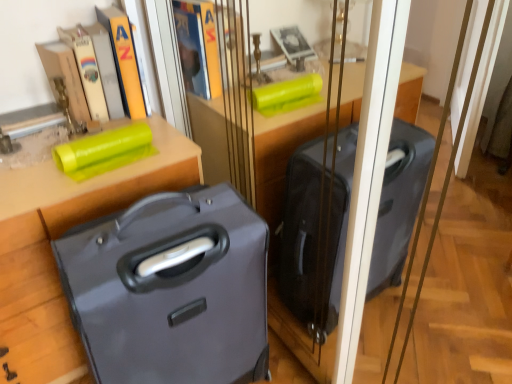
Question: Considering the positions of matte black suitcase at left and matte gray suitcase at lower left in the image, is matte black suitcase at left taller or shorter than matte gray suitcase at lower left?

Choices:
 (A) tall
 (B) short

Answer: (B)

Question: Visually, is matte black suitcase at left positioned to the left or to the right of matte gray suitcase at lower left?

Choices:
 (A) left
 (B) right

Answer: (A)

Question: In terms of size, does matte black suitcase at left appear bigger or smaller than matte gray suitcase at lower left?

Choices:
 (A) big
 (B) small

Answer: (A)

Question: Is matte gray suitcase at lower left in front of or behind matte black suitcase at left in the image?

Choices:
 (A) front
 (B) behind

Answer: (A)

Question: Is matte gray suitcase at lower left wider or thinner than matte black suitcase at left?

Choices:
 (A) wide
 (B) thin

Answer: (B)

Question: In terms of size, does matte gray suitcase at lower left appear bigger or smaller than matte black suitcase at left?

Choices:
 (A) small
 (B) big

Answer: (A)

Question: Visually, is matte gray suitcase at lower left positioned to the left or to the right of matte black suitcase at left?

Choices:
 (A) left
 (B) right

Answer: (B)